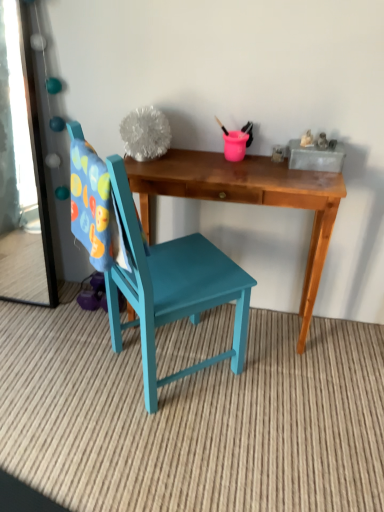
Question: Is point (0, 110) positioned closer to the camera than point (221, 280)?

Choices:
 (A) farther
 (B) closer

Answer: (A)

Question: Is clear glass mirror at left situated inside teal painted wood chair at center or outside?

Choices:
 (A) outside
 (B) inside

Answer: (A)

Question: Based on their relative distances, which object is farther from the wooden desk at center?

Choices:
 (A) teal painted wood chair at center
 (B) clear glass mirror at left

Answer: (B)

Question: Which is nearer to the wooden desk at center?

Choices:
 (A) teal painted wood chair at center
 (B) clear glass mirror at left

Answer: (A)